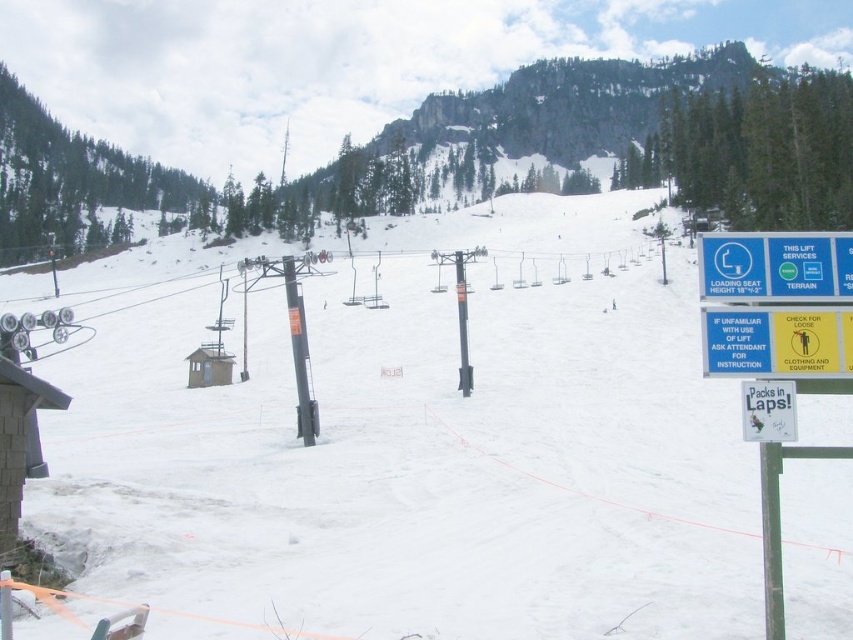
Question: Can you confirm if yellow paper sign at right is positioned to the right of white paper sign at lower right?

Choices:
 (A) no
 (B) yes

Answer: (B)

Question: Which point is farther from the camera taking this photo?

Choices:
 (A) (718, 256)
 (B) (126, 390)
 (C) (769, 417)

Answer: (B)

Question: Does white snow ski slope at center appear over blue plastic sign at upper right?

Choices:
 (A) yes
 (B) no

Answer: (A)

Question: Which is farther from the blue plastic sign at upper right?

Choices:
 (A) white snow ski slope at center
 (B) yellow paper sign at right
 (C) white paper sign at lower right

Answer: (A)

Question: Which is nearer to the yellow paper sign at right?

Choices:
 (A) white snow ski slope at center
 (B) blue plastic sign at upper right
 (C) white paper sign at lower right

Answer: (B)

Question: Can you confirm if yellow paper sign at right is positioned below blue plastic sign at upper right?

Choices:
 (A) no
 (B) yes

Answer: (B)